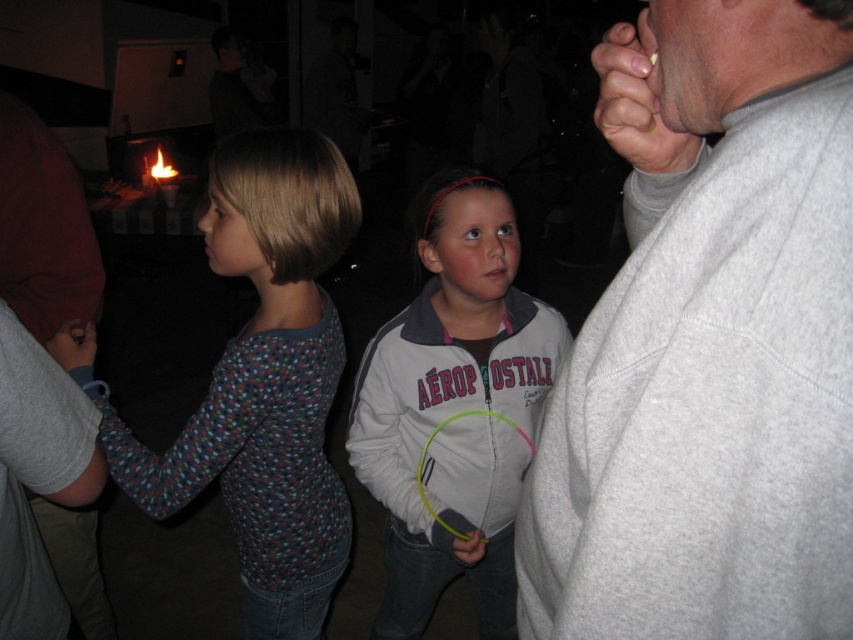
Question: Which object is farther from the camera taking this photo?

Choices:
 (A) gray fleece sweatshirt at right
 (B) multicolored knit sweater at left
 (C) gray matte hand at upper right
 (D) matte gray hand at lower left

Answer: (D)

Question: Is multicolored knit sweater at left bigger than matte gray hand at lower left?

Choices:
 (A) no
 (B) yes

Answer: (B)

Question: Can you confirm if multicolored knit sweater at left is thinner than white fleece jacket at center?

Choices:
 (A) yes
 (B) no

Answer: (B)

Question: Among these points, which one is farthest from the camera?

Choices:
 (A) (674, 148)
 (B) (622, 152)
 (C) (82, 358)
 (D) (242, 380)

Answer: (C)

Question: Can you confirm if gray matte hand at upper right is positioned to the left of matte gray hand at lower left?

Choices:
 (A) no
 (B) yes

Answer: (A)

Question: Which point appears closest to the camera in this image?

Choices:
 (A) (679, 99)
 (B) (488, 301)

Answer: (A)